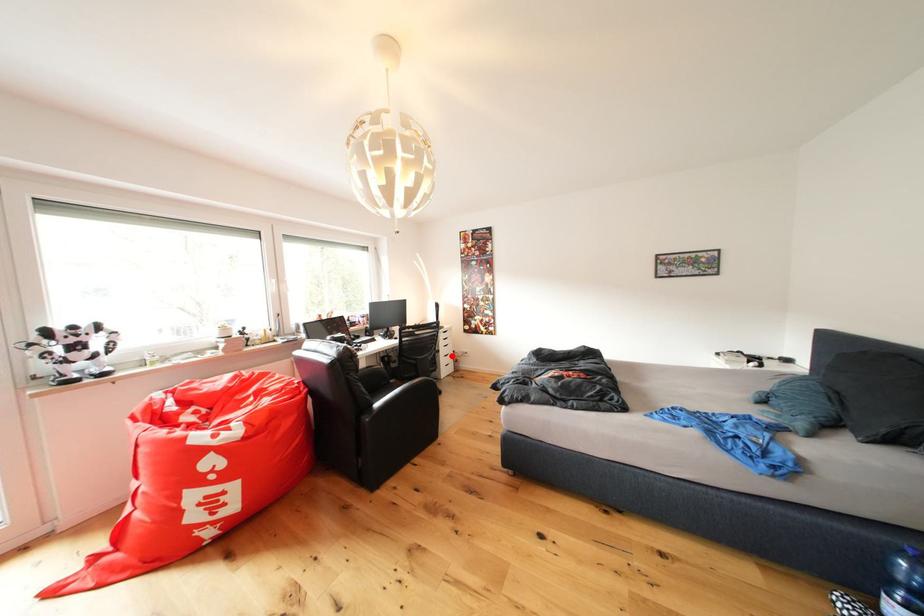
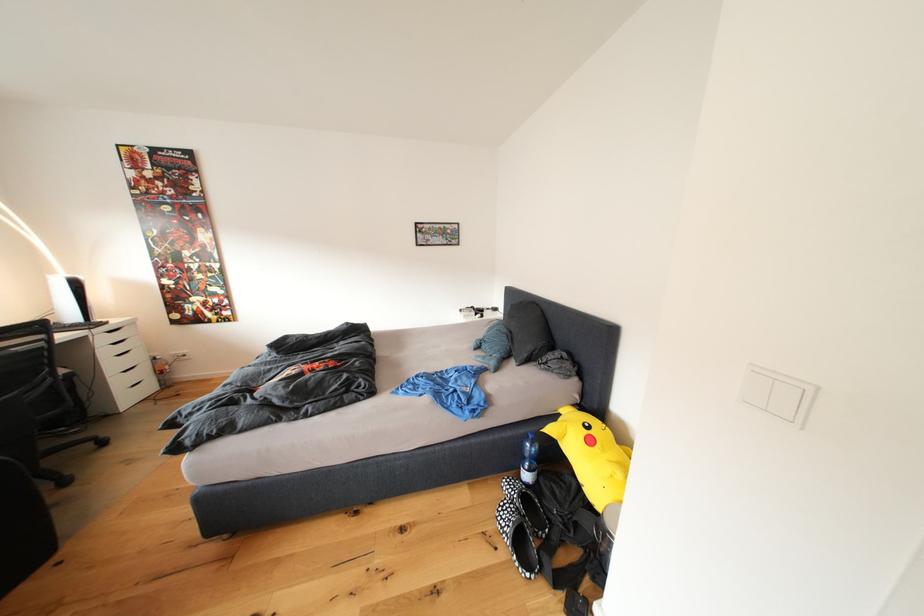
Question: I am providing you with two images of the same scene from different viewpoints. A red point is shown in image1. For the corresponding object point in image2, is it positioned nearer or farther from the camera?

Choices:
 (A) Nearer
 (B) Farther

Answer: (B)